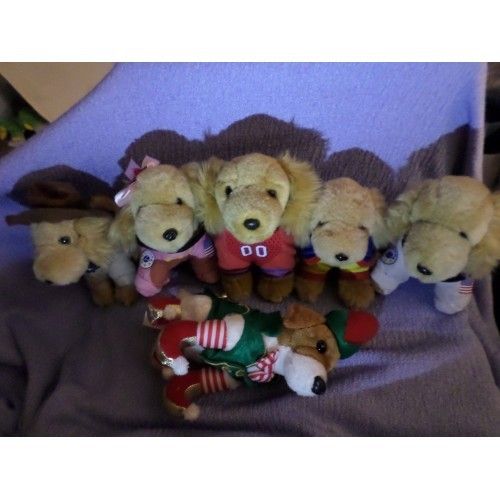
The image size is (500, 500). Find the location of `stuffed animal dogs standing up`. stuffed animal dogs standing up is located at coordinates (105, 271), (152, 218), (246, 227), (337, 238), (442, 247).